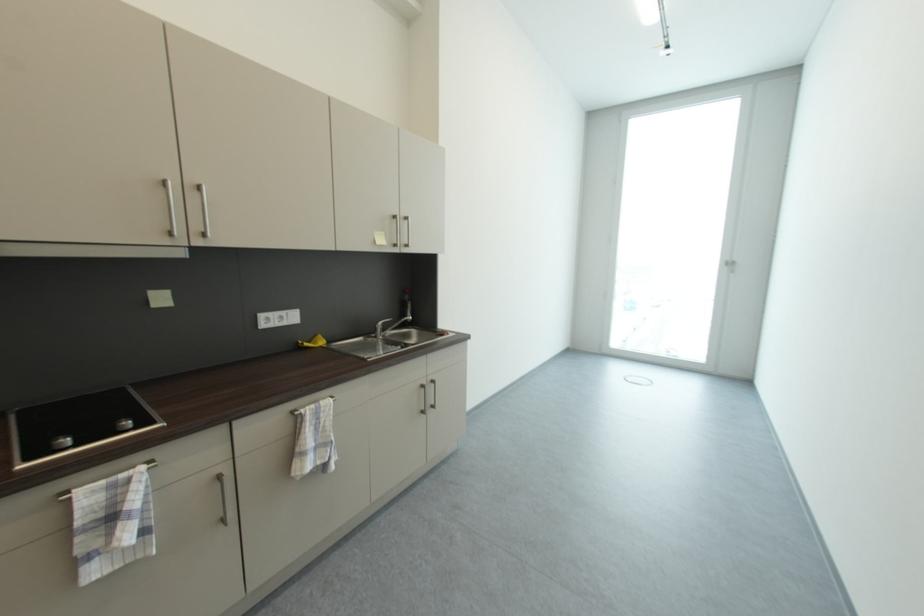
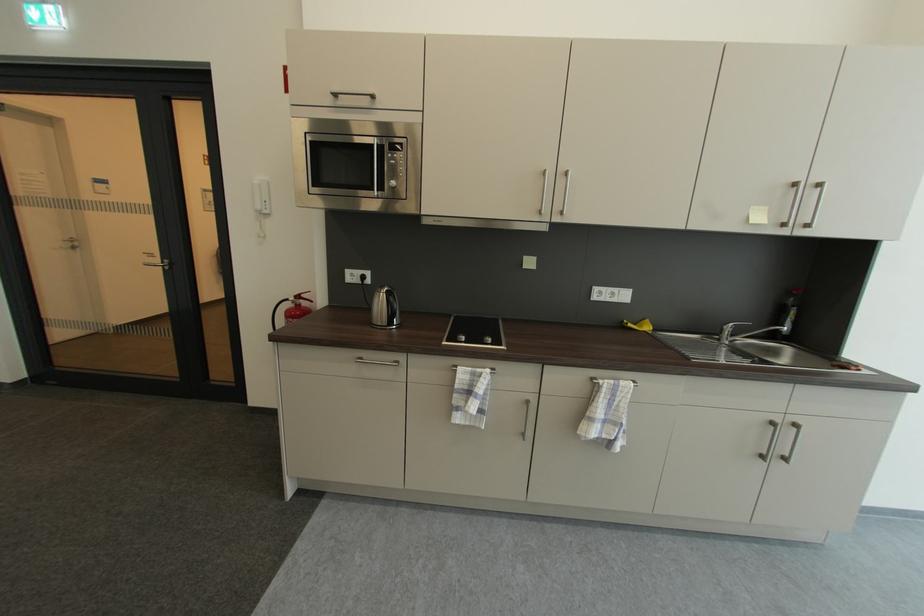
Question: The camera is either moving clockwise (left) or counter-clockwise (right) around the object. The first image is from the beginning of the video and the second image is from the end. Is the camera moving left or right when shooting the video?

Choices:
 (A) Left
 (B) Right

Answer: (B)